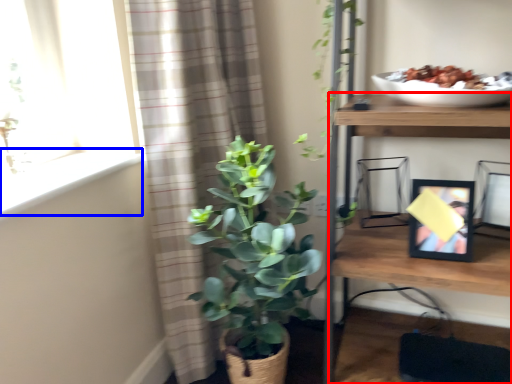
Question: Which object is closer to the camera taking this photo, shelf (highlighted by a red box) or window sill (highlighted by a blue box)?

Choices:
 (A) shelf
 (B) window sill

Answer: (A)